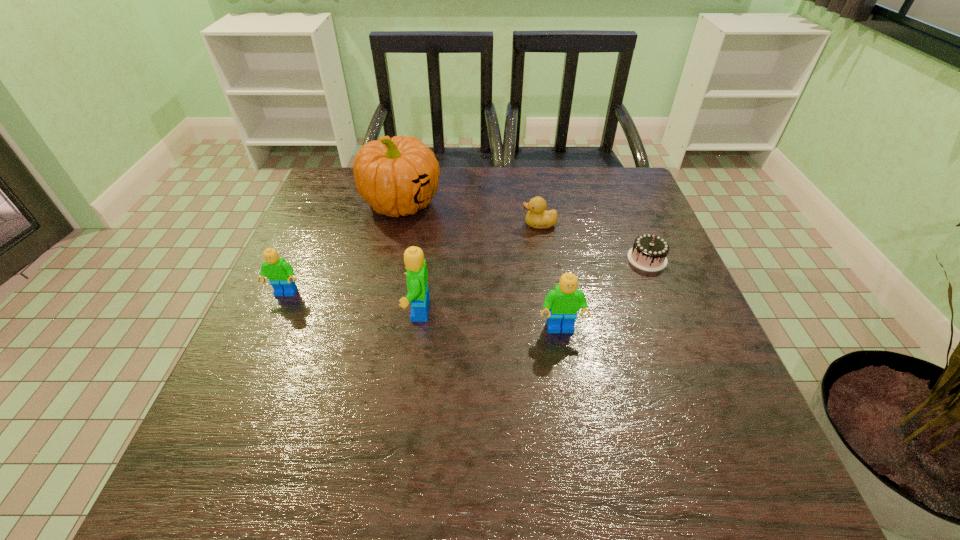
With all Legos evenly spaced, where should an extra Lego be placed on the right to continue the pattern? Please point out a vacant space. Please provide its 2D coordinates. Your answer should be formatted as a tuple, i.e. [(x, y)], where the tuple contains the x and y coordinates of a point satisfying the conditions above.

[(715, 350)]